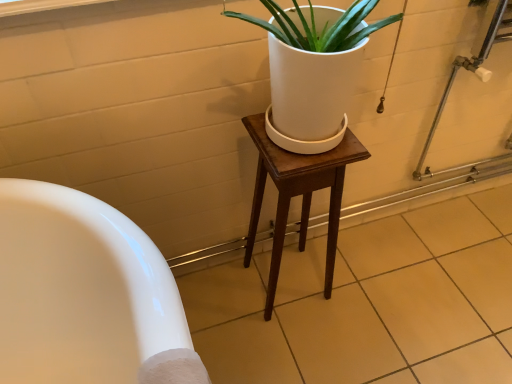
Question: Is wooden stool at center wider or thinner than white glossy tile at lower left?

Choices:
 (A) thin
 (B) wide

Answer: (A)

Question: Based on their positions, is wooden stool at center located to the left or right of white glossy tile at lower left?

Choices:
 (A) left
 (B) right

Answer: (A)

Question: Is wooden stool at center situated inside white glossy tile at lower left or outside?

Choices:
 (A) inside
 (B) outside

Answer: (B)

Question: From a real-world perspective, relative to wooden stool at center, is white glossy tile at lower left vertically above or below?

Choices:
 (A) below
 (B) above

Answer: (A)

Question: In terms of size, does white glossy tile at lower left appear bigger or smaller than wooden stool at center?

Choices:
 (A) small
 (B) big

Answer: (B)

Question: In the image, is white glossy tile at lower left on the left side or the right side of wooden stool at center?

Choices:
 (A) left
 (B) right

Answer: (B)

Question: From the image's perspective, is white glossy tile at lower left positioned above or below wooden stool at center?

Choices:
 (A) above
 (B) below

Answer: (B)